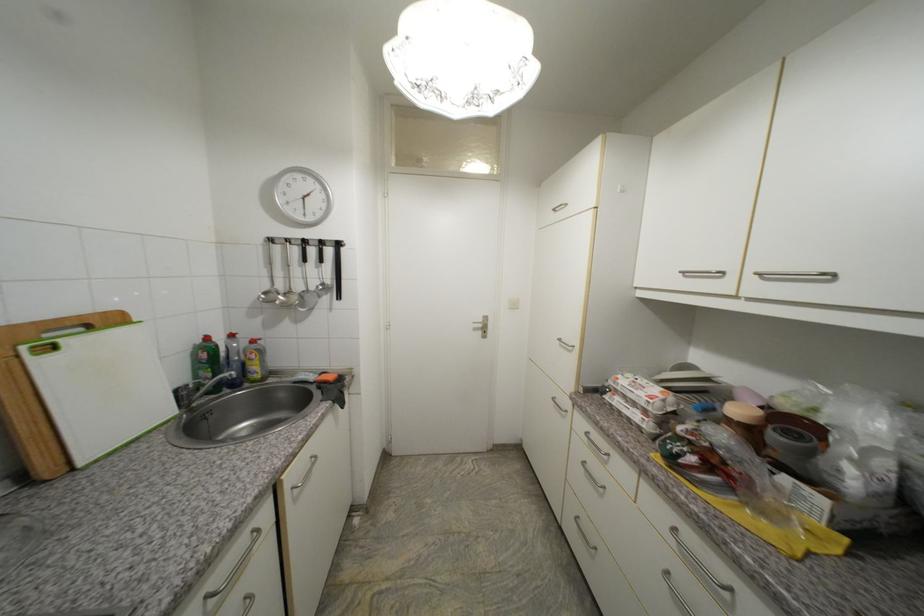
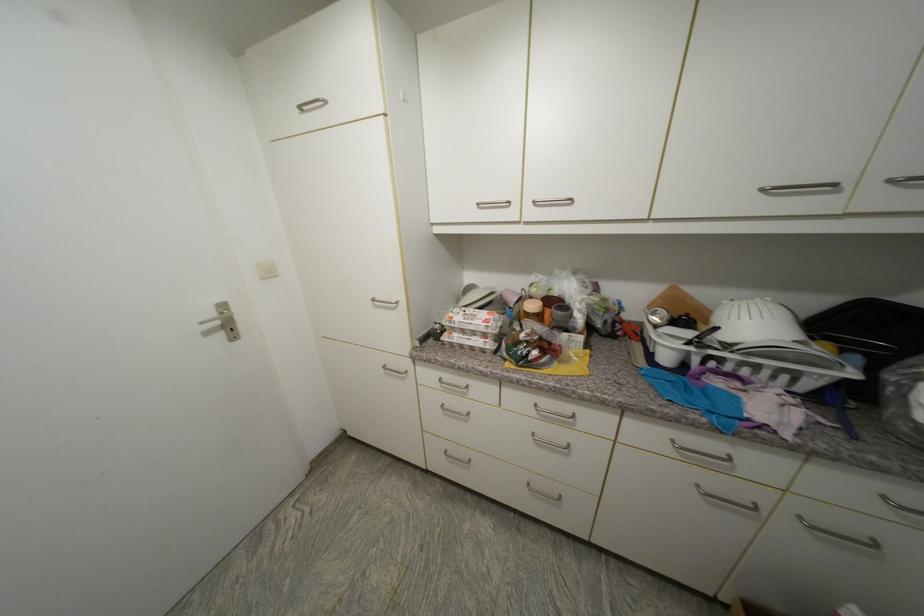
Where in the second image is the point corresponding to (x=519, y=307) from the first image?

(274, 275)